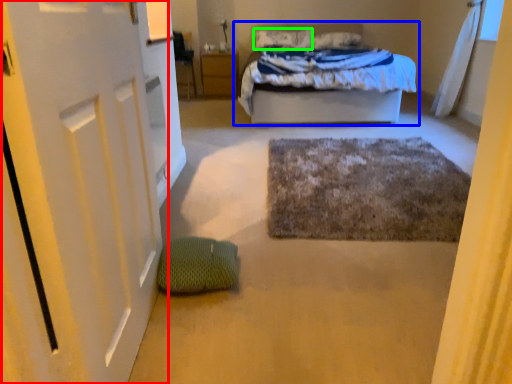
Question: Considering the real-world distances, which object is farthest from door (highlighted by a red box)? bed (highlighted by a blue box) or pillow (highlighted by a green box)?

Choices:
 (A) bed
 (B) pillow

Answer: (B)